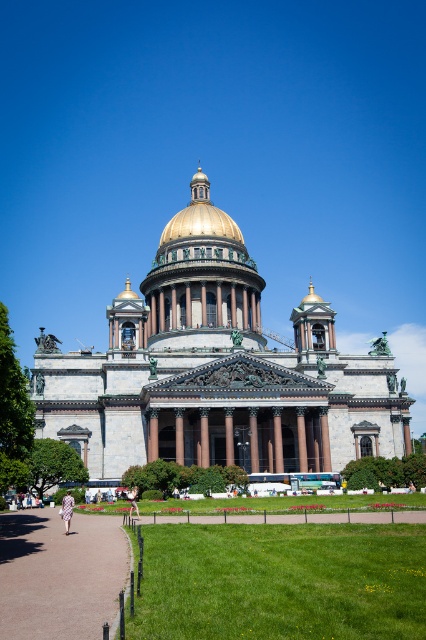
You are an architect examining the cathedral. You notice two domes at the center. Which one is taller, the golden dome church at center or the gold polished dome at center?

The golden dome church at center is taller than the gold polished dome at center according to the description.

You are standing in front of the cathedral and notice two points marked on the facade. The first point is at coordinates point (86, 614) and the second is at point (66, 516). Which point is nearer to your current position?

Point (86, 614) is closer to the camera than point (66, 516), so the first point is nearer to your current position.